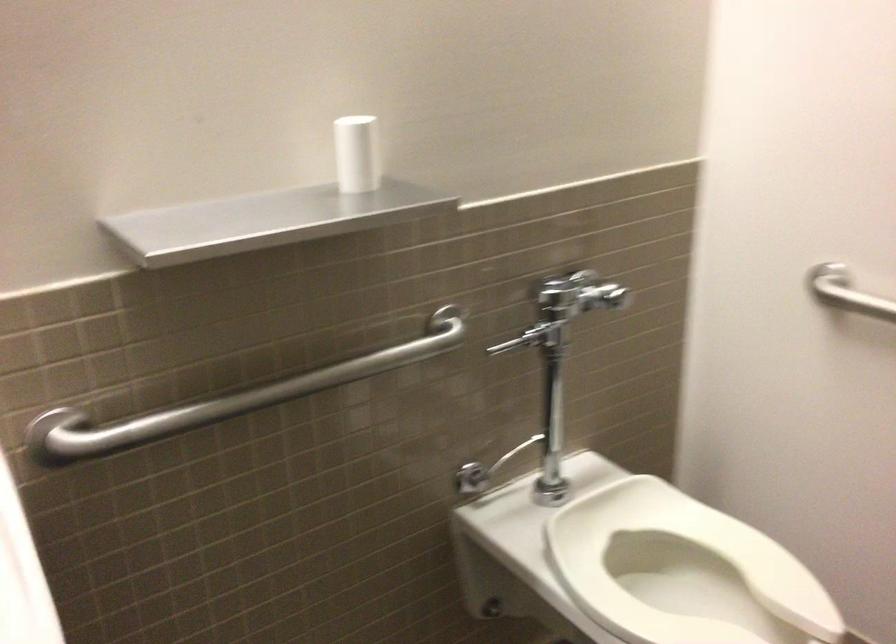
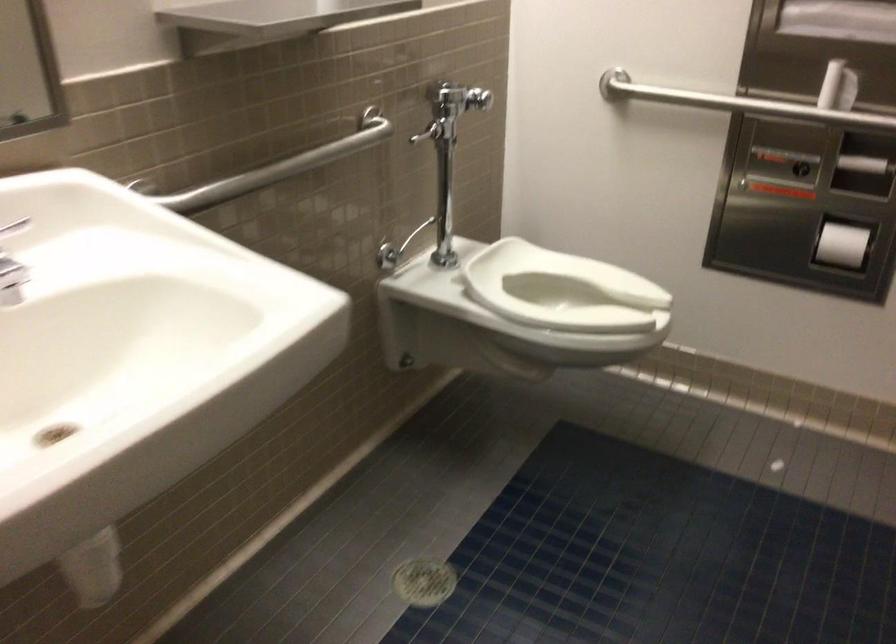
Question: The camera is either moving clockwise (left) or counter-clockwise (right) around the object. The first image is from the beginning of the video and the second image is from the end. Is the camera moving left or right when shooting the video?

Choices:
 (A) Left
 (B) Right

Answer: (A)